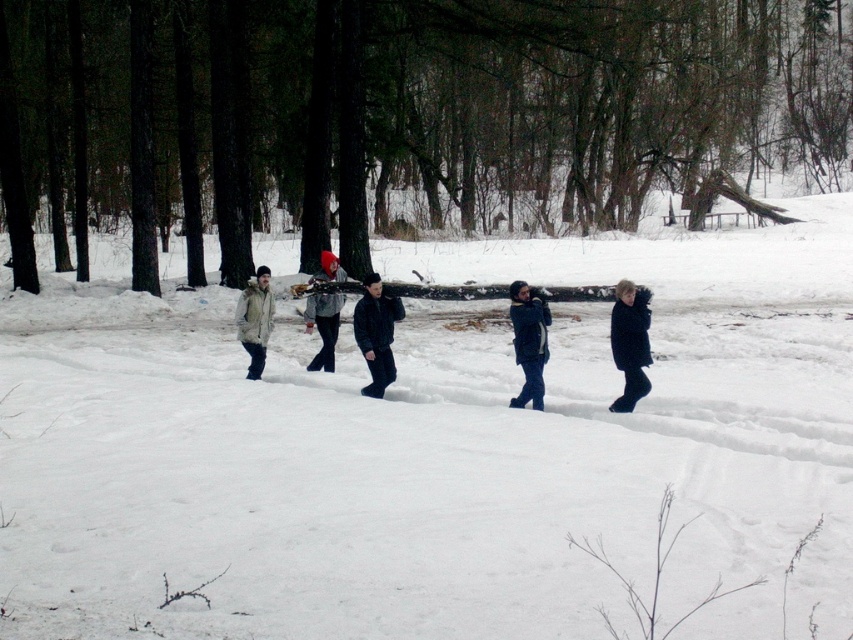
Question: Estimate the real-world distances between objects in this image. Which object is closer to the white fluffy snow at center?

Choices:
 (A) dark blue coat at right
 (B) light beige jacket at left

Answer: (A)

Question: Does dark blue coat at right come behind light beige jacket at left?

Choices:
 (A) yes
 (B) no

Answer: (B)

Question: Is dark blue jacket at center closer to camera compared to matte gray jacket at center?

Choices:
 (A) no
 (B) yes

Answer: (B)

Question: Which of the following is the closest to the observer?

Choices:
 (A) matte gray jacket at center
 (B) dark blue coat at right

Answer: (B)

Question: Which point is closer to the camera taking this photo?

Choices:
 (A) (262, 310)
 (B) (90, 156)

Answer: (A)

Question: Is white fluffy snow at center to the left of matte gray jacket at center from the viewer's perspective?

Choices:
 (A) no
 (B) yes

Answer: (A)